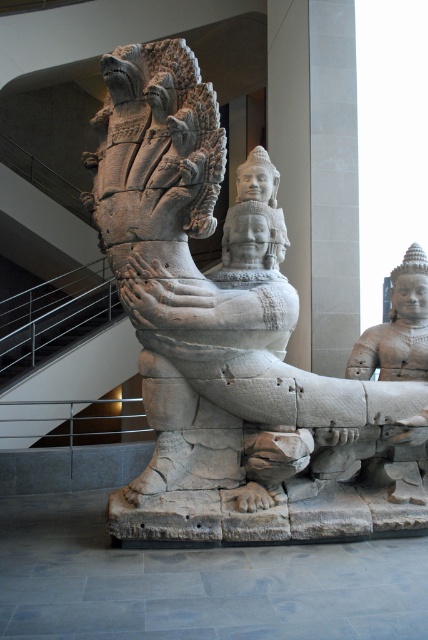
Which of these two, white stone statue at center or metal/rail at left, stands taller?

white stone statue at center

Consider the image. Is white stone statue at center to the left of metal/rail at left from the viewer's perspective?

No, white stone statue at center is not to the left of metal/rail at left.

Does point (264, 192) come closer to viewer compared to point (2, 380)?

Yes, point (264, 192) is in front of point (2, 380).

What are the coordinates of `white stone statue at center` in the screenshot? It's located at (213, 301).